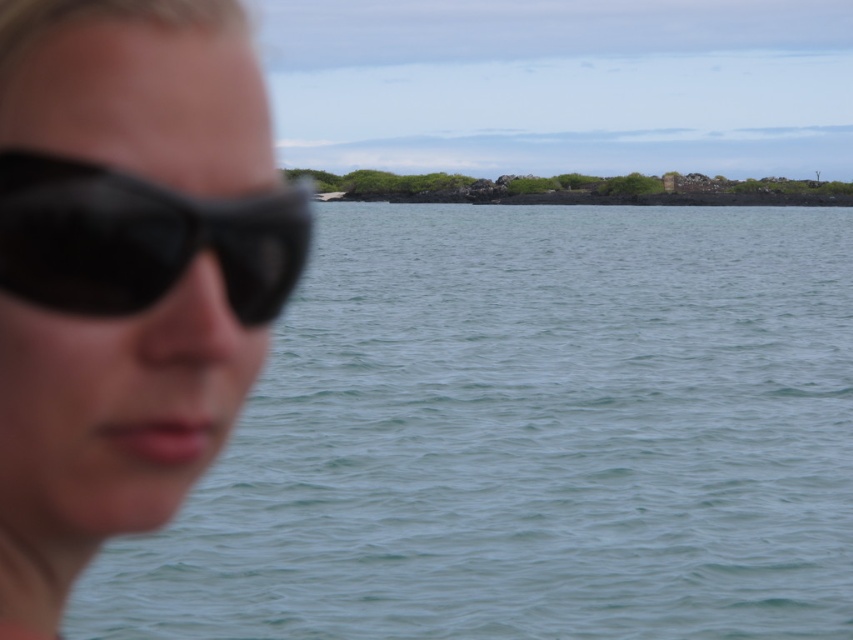
Question: Does clear water at center appear under matte black sunglasses at left?

Choices:
 (A) no
 (B) yes

Answer: (A)

Question: Can you confirm if clear water at center is positioned below matte black sunglasses at left?

Choices:
 (A) yes
 (B) no

Answer: (B)

Question: Which of the following is the closest to the observer?

Choices:
 (A) (160, 276)
 (B) (32, 497)
 (C) (341, 552)

Answer: (A)

Question: Which object is closer to the camera taking this photo?

Choices:
 (A) matte black sunglasses at left
 (B) clear water at center

Answer: (A)

Question: Among these objects, which one is nearest to the camera?

Choices:
 (A) black matte sunglasses at left
 (B) clear water at center

Answer: (A)

Question: Considering the relative positions of clear water at center and matte black sunglasses at left in the image provided, where is clear water at center located with respect to matte black sunglasses at left?

Choices:
 (A) left
 (B) right

Answer: (B)